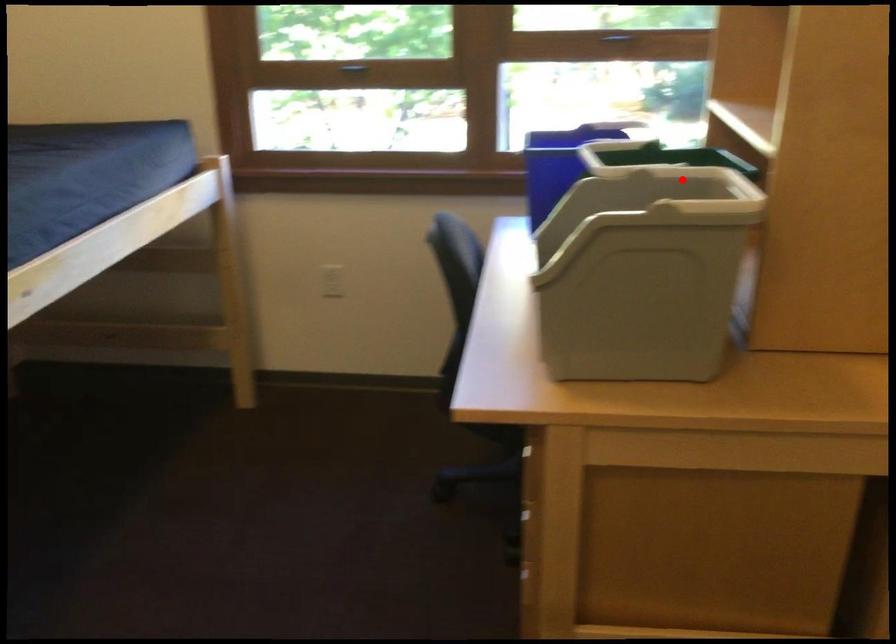
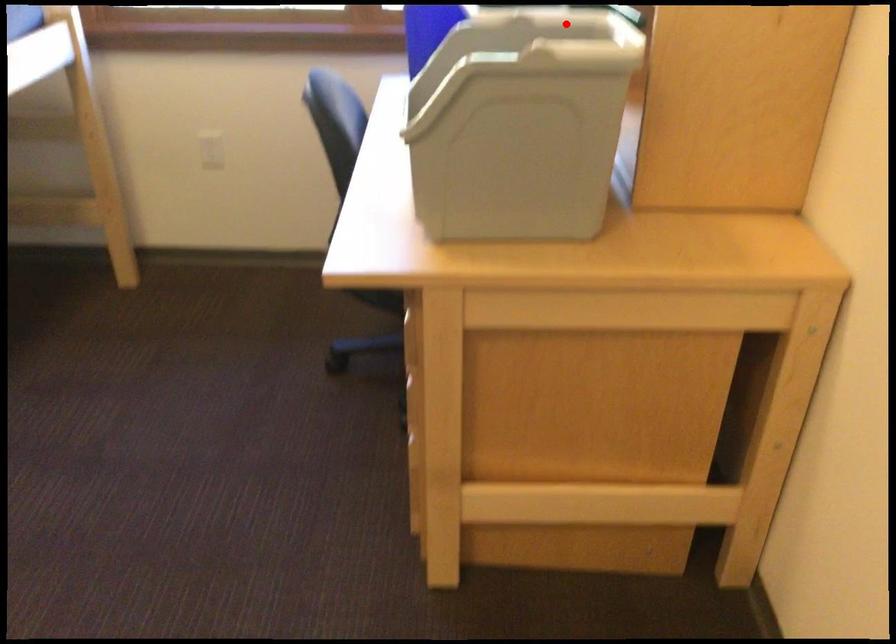
From the picture: I am providing you with two images of the same scene from different viewpoints. A red point is marked on the first image and another point is marked on the second image. Are the points marked in image1 and image2 representing the same 3D position?

Yes